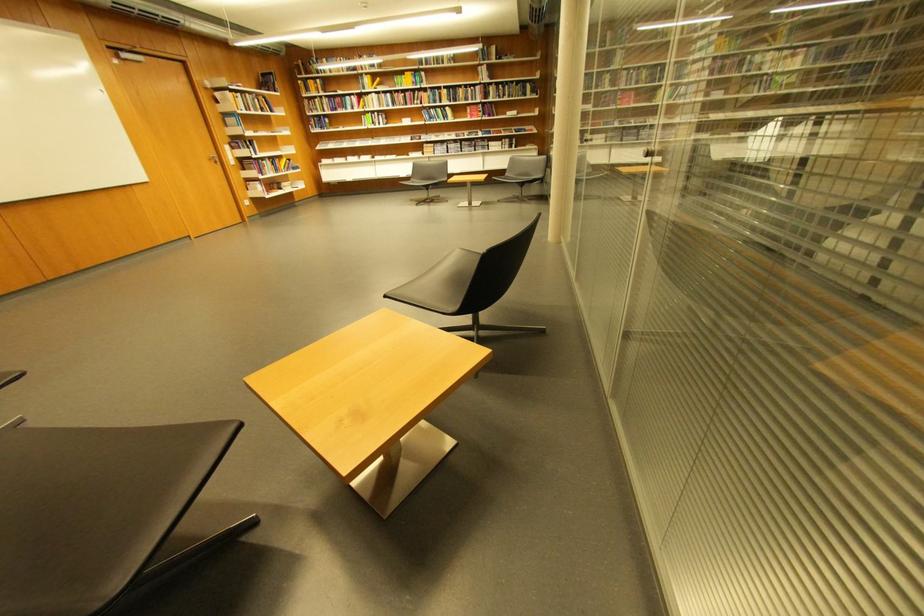
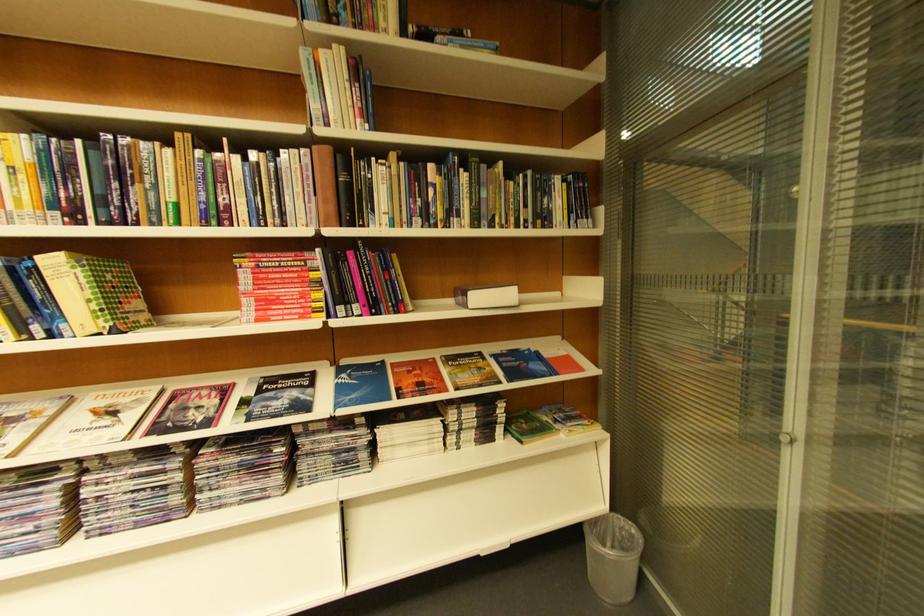
The point at (482, 108) is marked in the first image. Where is the corresponding point in the second image?

(281, 262)